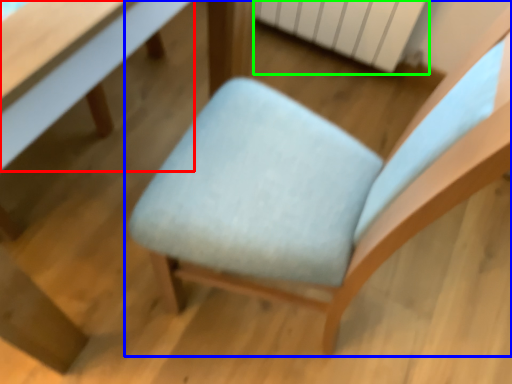
Question: Which object is the closest to the table (highlighted by a red box)? Choose among these: chair (highlighted by a blue box) or radiator (highlighted by a green box).

Choices:
 (A) chair
 (B) radiator

Answer: (A)